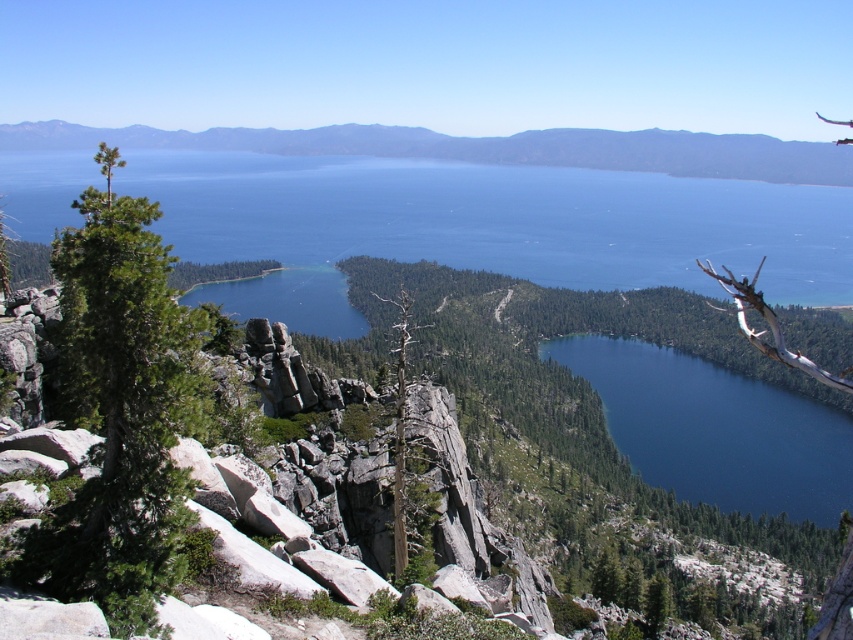
The height and width of the screenshot is (640, 853). What do you see at coordinates (485, 147) in the screenshot? I see `green textured rock at upper center` at bounding box center [485, 147].

Who is taller, green textured rock at upper center or dead wood tree at center?

green textured rock at upper center is taller.

Image resolution: width=853 pixels, height=640 pixels. What do you see at coordinates (485, 147) in the screenshot?
I see `green textured rock at upper center` at bounding box center [485, 147].

The height and width of the screenshot is (640, 853). I want to click on green textured rock at upper center, so click(485, 147).

Between green needle-like tree at left and green textured rock at upper center, which one has more height?

green textured rock at upper center is taller.

Which is in front, point (73, 317) or point (578, 163)?

Point (73, 317) is more forward.

This screenshot has height=640, width=853. I want to click on green needle-like tree at left, so click(x=122, y=410).

Is deep blue water at center closer to camera compared to dead wood tree at center?

No.

Is deep blue water at center positioned behind dead wood tree at center?

That is True.

Is point (746, 438) positioned in front of point (393, 513)?

No, it is behind (393, 513).

This screenshot has height=640, width=853. I want to click on deep blue water at center, so click(715, 429).